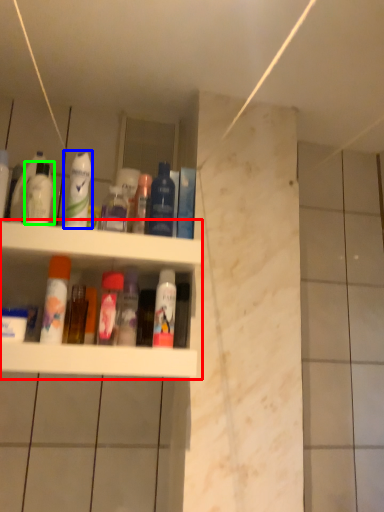
Question: Considering the real-world distances, which object is farthest from shelf (highlighted by a red box)? cleaning product (highlighted by a blue box) or mouthwash (highlighted by a green box)?

Choices:
 (A) cleaning product
 (B) mouthwash

Answer: (B)